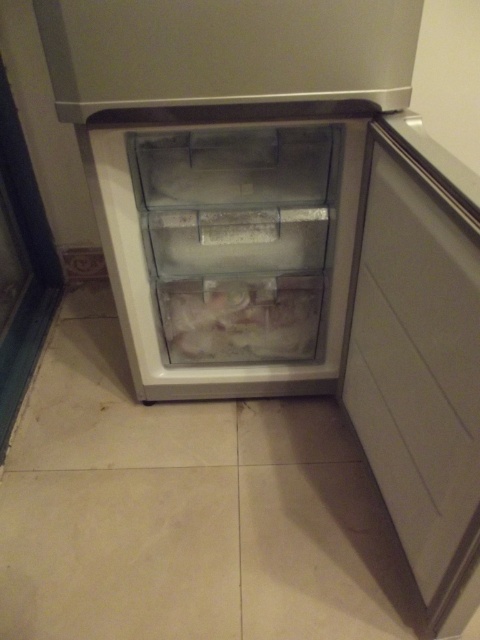
Consider the image. Can you confirm if white matte door at right is bigger than frozen white food at center?

Yes, white matte door at right is bigger than frozen white food at center.

Is white matte door at right thinner than frozen white food at center?

Yes, white matte door at right is thinner than frozen white food at center.

Which is behind, point (474, 580) or point (211, 356)?

Positioned behind is point (211, 356).

Locate an element on the screen. The image size is (480, 640). white matte door at right is located at coordinates (420, 365).